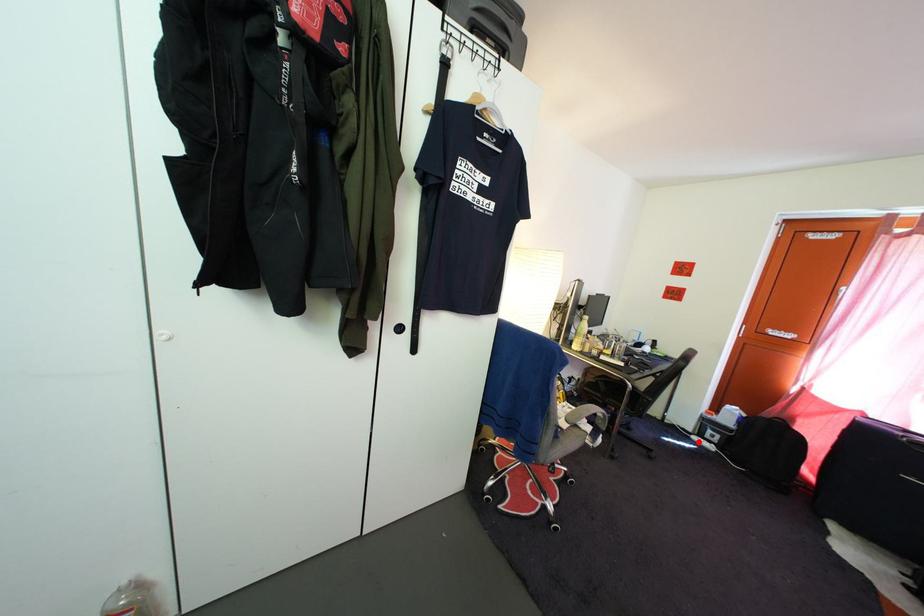
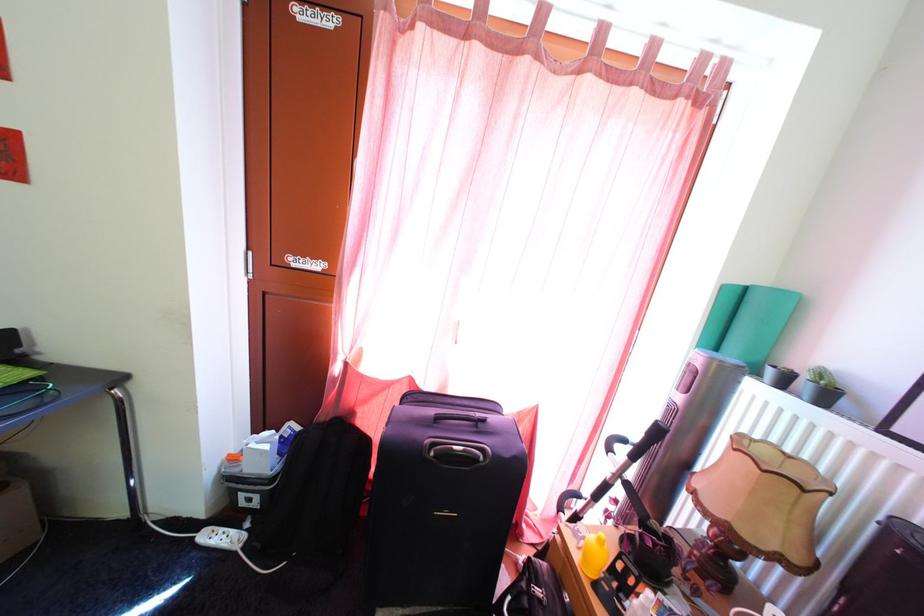
Question: I am providing you with two images of the same scene from different viewpoints. Given a red point in image1, look at the same physical point in image2. Is it:

Choices:
 (A) Closer to the viewpoint
 (B) Farther from the viewpoint

Answer: (A)